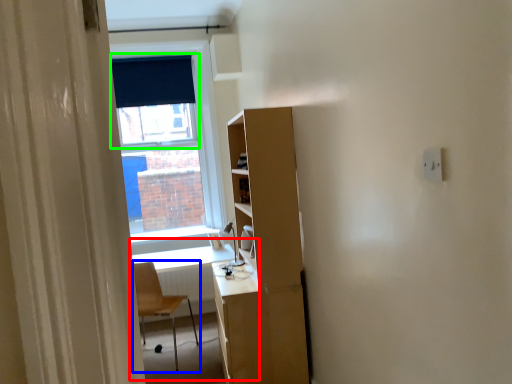
Question: Which is nearer to the computer desk (highlighted by a red box)? chair (highlighted by a blue box) or window screen (highlighted by a green box).

Choices:
 (A) chair
 (B) window screen

Answer: (A)